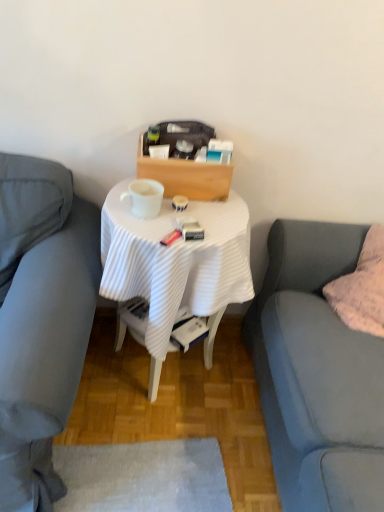
The height and width of the screenshot is (512, 384). Identify the location of free spot below white ribbed cloth at center (from a real-world perspective). (170, 378).